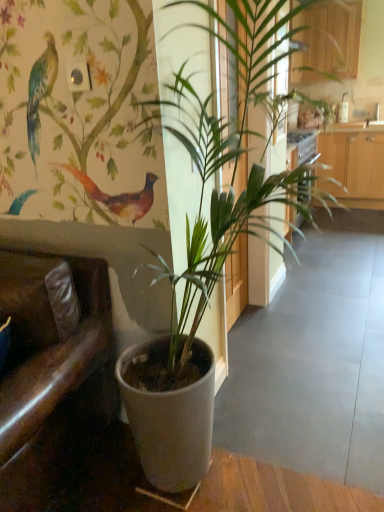
Question: Is brown leather armchair at left positioned with its back to wooden cabinet at upper right?

Choices:
 (A) no
 (B) yes

Answer: (B)

Question: Are brown leather armchair at left and wooden cabinet at upper right beside each other?

Choices:
 (A) no
 (B) yes

Answer: (A)

Question: Is brown leather armchair at left shorter than wooden cabinet at upper right?

Choices:
 (A) no
 (B) yes

Answer: (A)

Question: From the image's perspective, is brown leather armchair at left below wooden cabinet at upper right?

Choices:
 (A) yes
 (B) no

Answer: (A)

Question: Would you say wooden cabinet at upper right is part of brown leather armchair at left's contents?

Choices:
 (A) no
 (B) yes

Answer: (A)

Question: Is brown leather armchair at left in front of or behind green matte plant at center in the image?

Choices:
 (A) front
 (B) behind

Answer: (B)

Question: Does point (x=66, y=373) appear closer or farther from the camera than point (x=278, y=45)?

Choices:
 (A) closer
 (B) farther

Answer: (B)

Question: From their relative heights in the image, would you say brown leather armchair at left is taller or shorter than green matte plant at center?

Choices:
 (A) short
 (B) tall

Answer: (A)

Question: From the image's perspective, is brown leather armchair at left located above or below green matte plant at center?

Choices:
 (A) above
 (B) below

Answer: (B)

Question: From the image's perspective, relative to wooden cabinet at upper right, is green matte plant at center above or below?

Choices:
 (A) below
 (B) above

Answer: (A)

Question: In terms of width, does green matte plant at center look wider or thinner when compared to wooden cabinet at upper right?

Choices:
 (A) thin
 (B) wide

Answer: (B)

Question: In terms of height, does green matte plant at center look taller or shorter compared to wooden cabinet at upper right?

Choices:
 (A) tall
 (B) short

Answer: (A)

Question: Is green matte plant at center inside or outside of wooden cabinet at upper right?

Choices:
 (A) inside
 (B) outside

Answer: (B)

Question: From a real-world perspective, is wooden cabinet at upper right above or below brown leather armchair at left?

Choices:
 (A) above
 (B) below

Answer: (A)

Question: Visually, is wooden cabinet at upper right positioned to the left or to the right of brown leather armchair at left?

Choices:
 (A) right
 (B) left

Answer: (A)